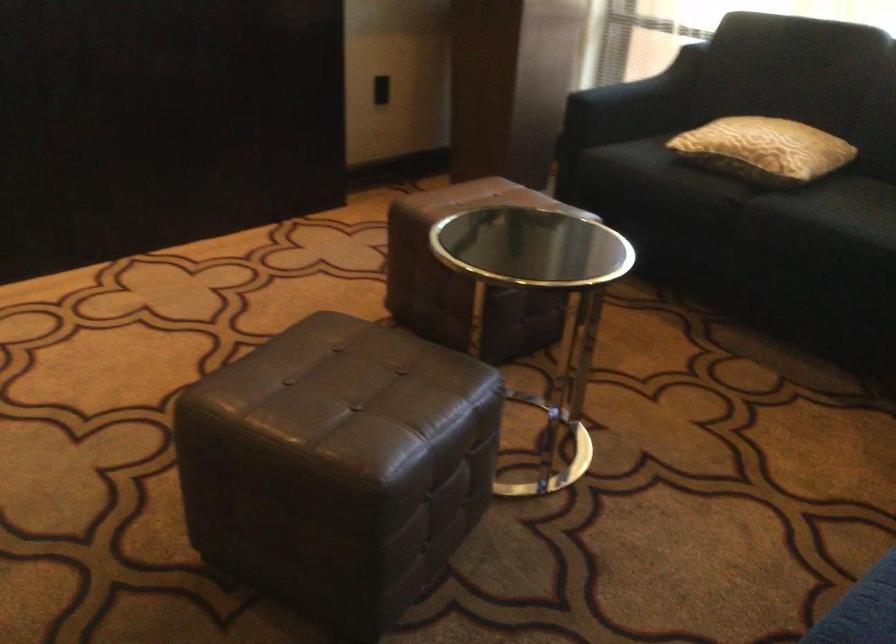
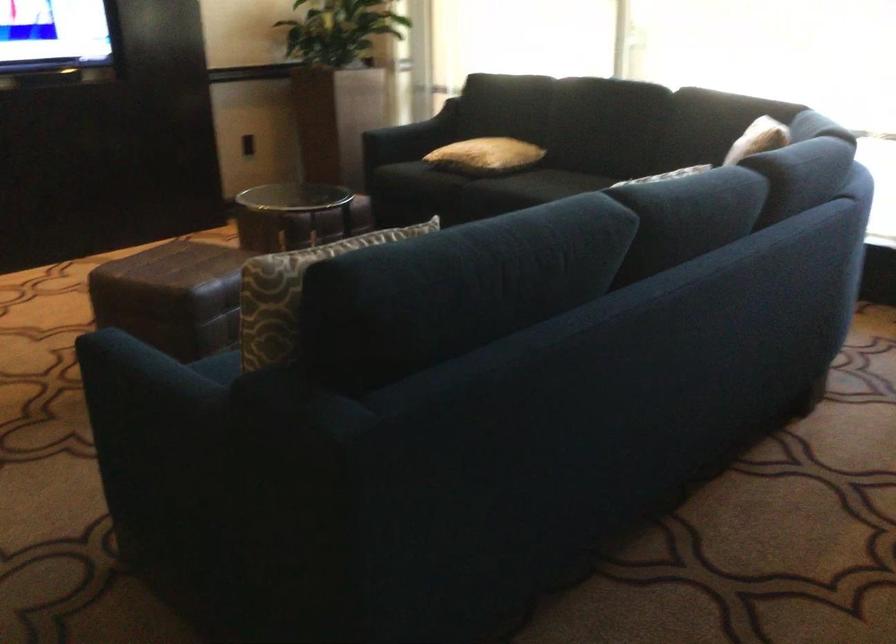
In a continuous first-person perspective shot, in which direction is the camera moving?

The cameraman walked toward right, backward.